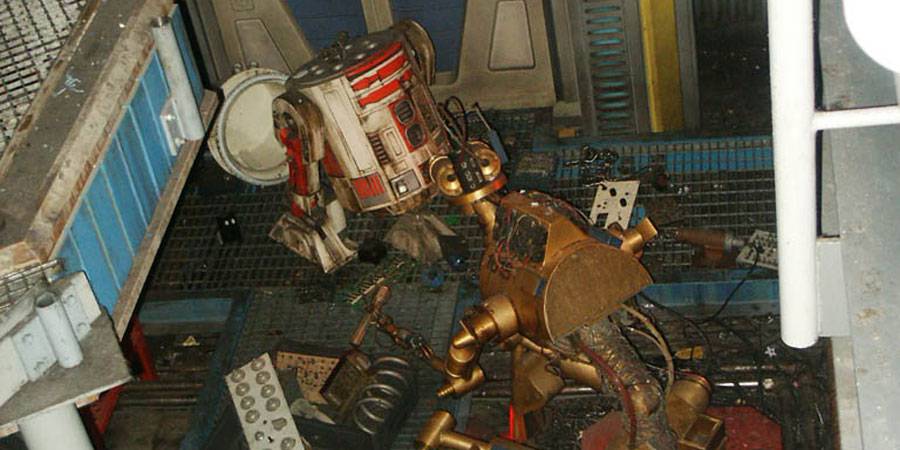
What are the coordinates of `left pipe` in the screenshot? It's located at (171, 53).